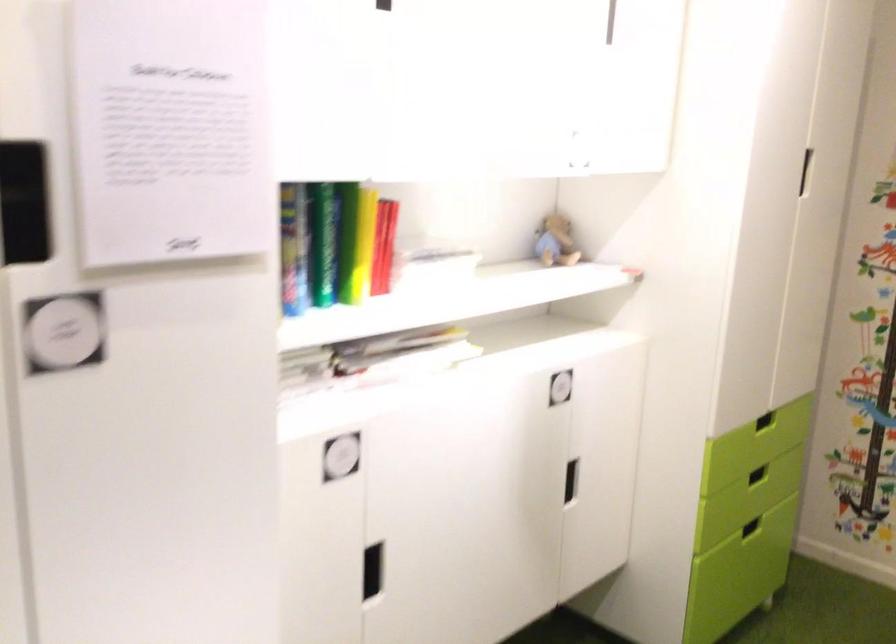
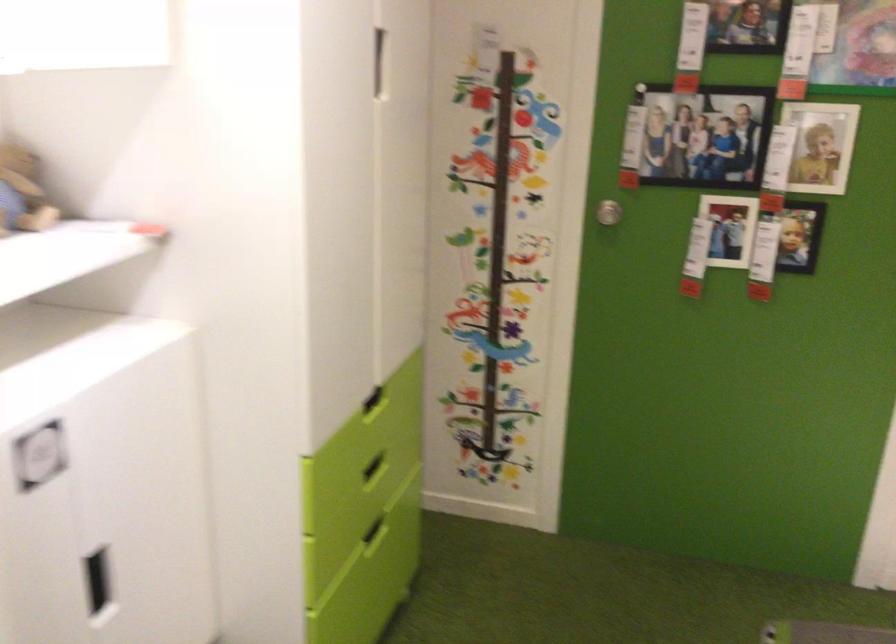
Find the pixel in the second image that matches [756,525] in the first image.

(375, 531)